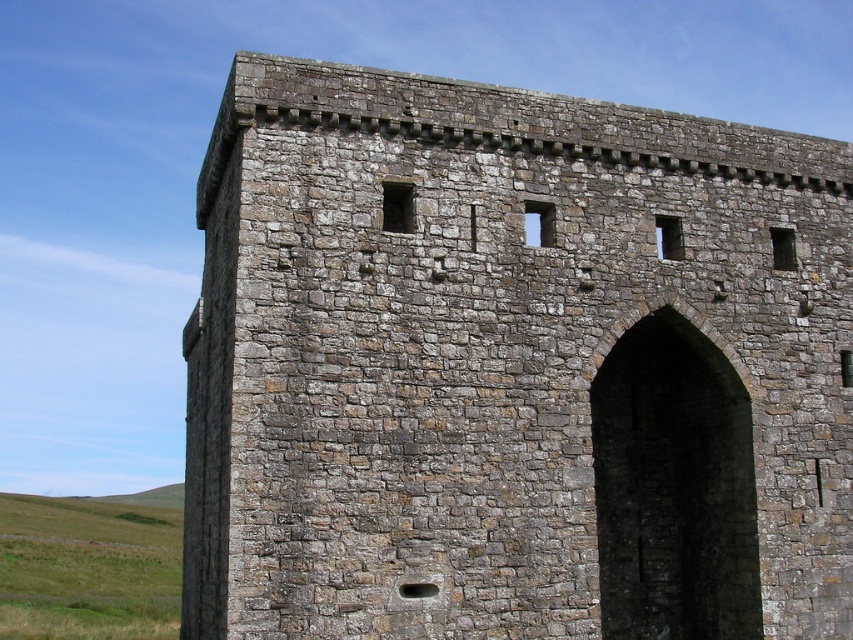
Question: Considering the relative positions of brown stone wall at center and green grass at lower left in the image provided, where is brown stone wall at center located with respect to green grass at lower left?

Choices:
 (A) below
 (B) above

Answer: (B)

Question: Considering the relative positions of brown stone wall at center and green grass at lower left in the image provided, where is brown stone wall at center located with respect to green grass at lower left?

Choices:
 (A) right
 (B) left

Answer: (A)

Question: Which of the following is the closest to the observer?

Choices:
 (A) green grass at lower left
 (B) brown stone wall at center

Answer: (B)

Question: Is brown stone wall at center thinner than green grass at lower left?

Choices:
 (A) no
 (B) yes

Answer: (B)

Question: Which point is closer to the camera?

Choices:
 (A) brown stone wall at center
 (B) green grass at lower left

Answer: (A)